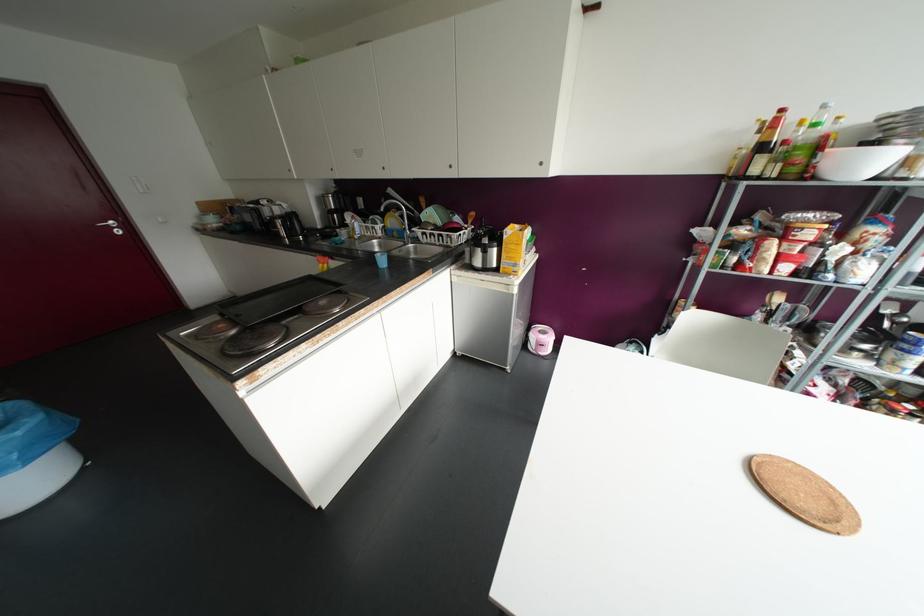
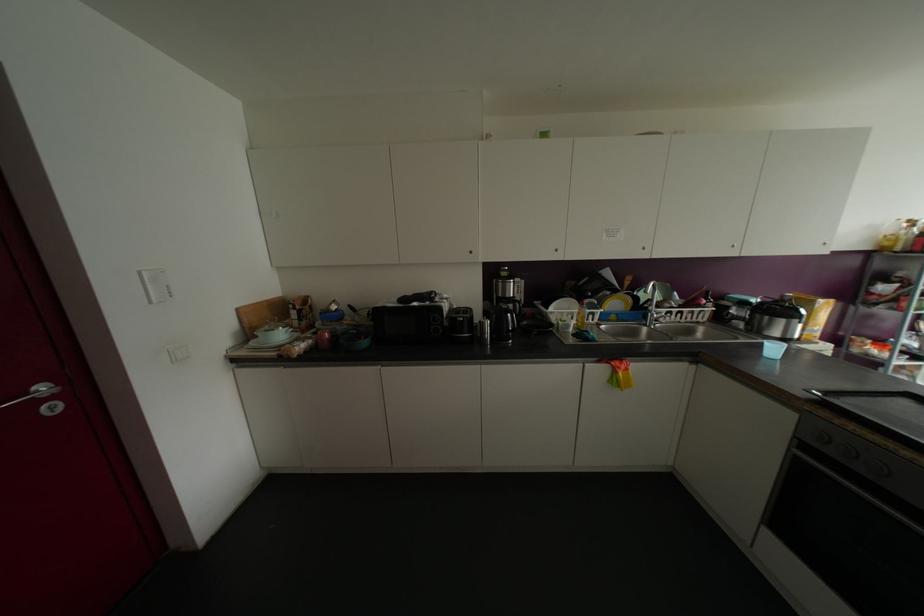
The point at (383,168) is marked in the first image. Where is the corresponding point in the second image?

(642, 248)